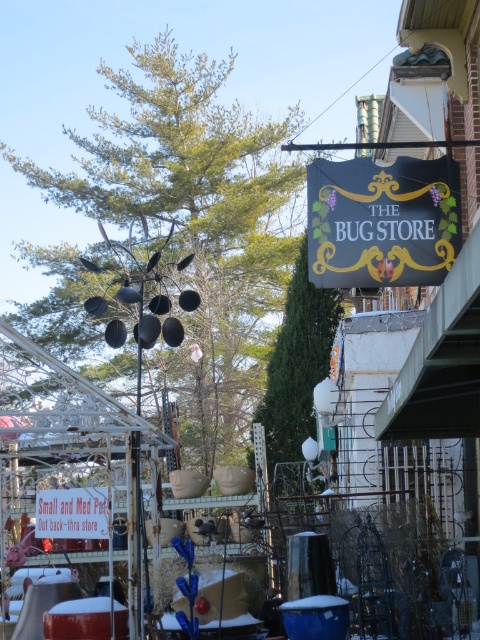
Looking at this image, you are standing in front of the storefront and want to locate the black fabric sign at upper center. According to the scene description, where should you look relative to the other items displayed to the left of the sign?

The black fabric sign at upper center is located at point (383, 221), so you should look towards the upper part of the storefront near the center to find it, as it is positioned above the items displayed to the left.

You are a customer looking at the storefront and want to read both the black fabric sign at upper center and the red plastic sign at lower left. Which sign do you need to look at first to read the smaller one?

The black fabric sign at upper center has a smaller size compared to the red plastic sign at lower left, so you should look at the black fabric sign at upper center first to read the smaller one.